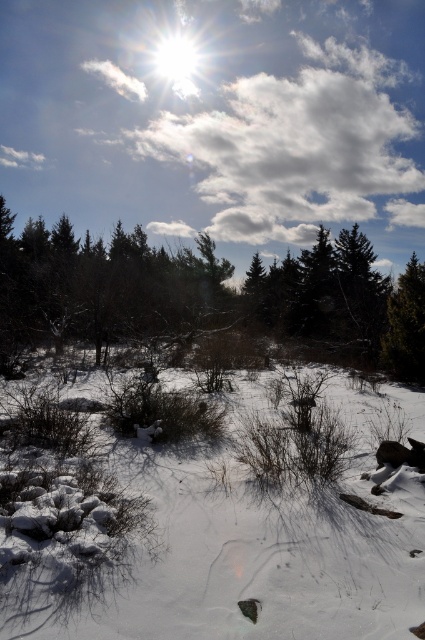
Does brown textured tree at center have a smaller size compared to green matte tree at right?

Actually, brown textured tree at center might be larger than green matte tree at right.

Measure the distance between brown textured tree at center and camera.

brown textured tree at center is 14.24 meters from camera.

Describe the element at coordinates (203, 292) in the screenshot. I see `brown textured tree at center` at that location.

Find the location of `brown textured tree at center`. brown textured tree at center is located at coordinates (203, 292).

Looking at this image, which is more to the left, white fluffy cloud at upper center or brown textured tree at center?

From the viewer's perspective, brown textured tree at center appears more on the left side.

Is point (308, 129) positioned in front of point (127, 291)?

No, it is not.

This screenshot has height=640, width=425. What are the coordinates of `white fluffy cloud at upper center` in the screenshot? It's located at (218, 120).

How far apart are white fluffy cloud at upper center and white powdery snow at center?

79.30 meters

Between white fluffy cloud at upper center and white powdery snow at center, which one has more height?

With more height is white fluffy cloud at upper center.

Between point (45, 13) and point (303, 440), which one is positioned behind?

Positioned behind is point (45, 13).

Identify the location of white fluffy cloud at upper center. coord(218,120).